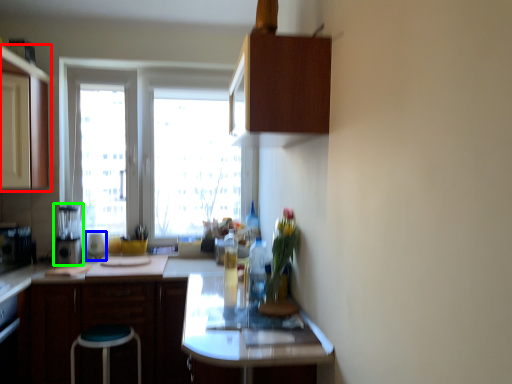
Question: Estimate the real-world distances between objects in this image. Which object is closer to cabinetry (highlighted by a red box), appliance (highlighted by a blue box) or appliance (highlighted by a green box)?

Choices:
 (A) appliance
 (B) appliance

Answer: (B)